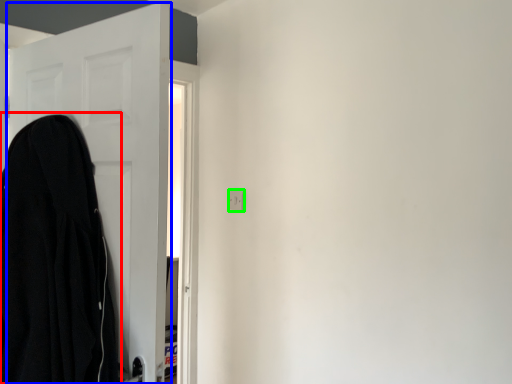
Question: Which object is the farthest from cloak (highlighted by a red box)? Choose among these: door (highlighted by a blue box) or electric outlet (highlighted by a green box).

Choices:
 (A) door
 (B) electric outlet

Answer: (B)